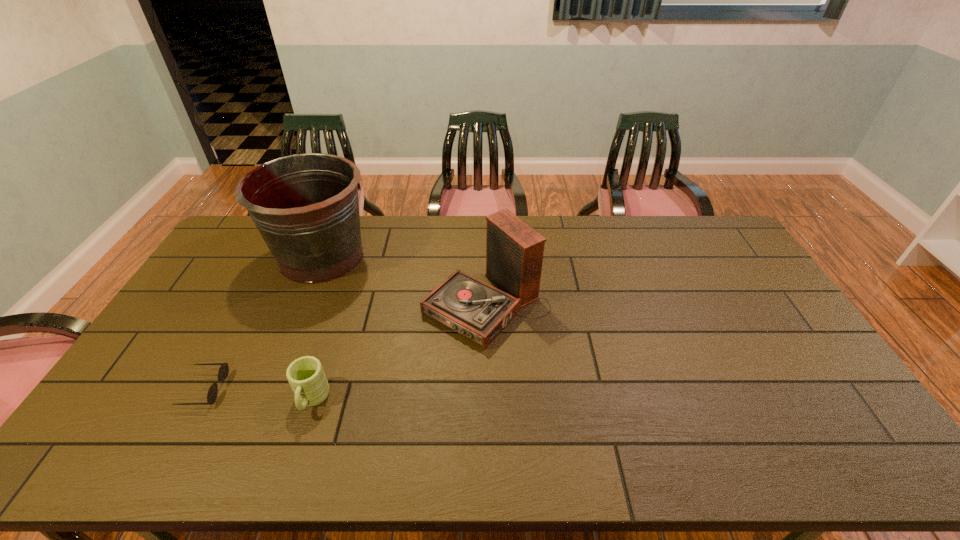
The image size is (960, 540). I want to click on the tallest object, so click(306, 207).

Where is `the rightmost object`? the rightmost object is located at coordinates (514, 251).

This screenshot has width=960, height=540. Find the location of `phonograph record`. phonograph record is located at coordinates (514, 251).

This screenshot has height=540, width=960. In order to click on the third tallest object in this screenshot , I will do `click(305, 375)`.

At what (x,y) coordinates should I click in order to perform the action: click on sunglasses. Please return your answer as a coordinate pair (x, y). Looking at the image, I should click on (223, 371).

Find the location of a particular element. free space located on the back of the bucket is located at coordinates click(338, 217).

This screenshot has width=960, height=540. Identify the location of free space located on the back of the second tallest object. (485, 222).

This screenshot has width=960, height=540. Find the location of `free space located 0.110m on the side of the mug with the handle`. free space located 0.110m on the side of the mug with the handle is located at coordinates (291, 464).

This screenshot has height=540, width=960. Find the location of `blank space located 0.380m on the front-facing side of the sunglasses`. blank space located 0.380m on the front-facing side of the sunglasses is located at coordinates (364, 389).

The image size is (960, 540). What are the coordinates of `object at the far edge` in the screenshot? It's located at (306, 207).